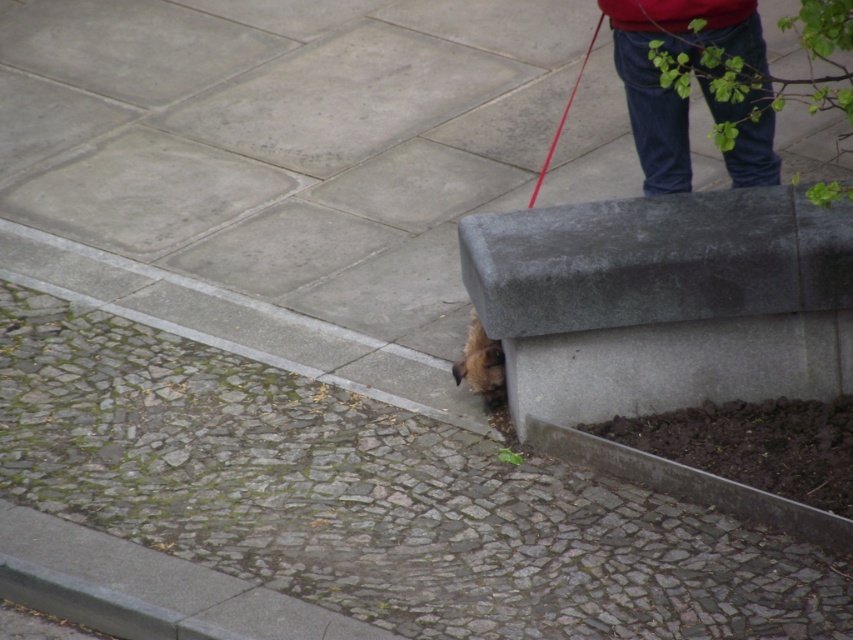
Question: Among these points, which one is nearest to the camera?

Choices:
 (A) (596, 33)
 (B) (741, 172)
 (C) (502, 358)

Answer: (C)

Question: Is denim pants at upper right below red rubber leash at upper right?

Choices:
 (A) no
 (B) yes

Answer: (B)

Question: Among these objects, which one is farthest from the camera?

Choices:
 (A) denim pants at upper right
 (B) red rubber leash at upper right
 (C) brown furry dog at lower center

Answer: (B)

Question: Which point is closer to the camera?

Choices:
 (A) (477, 328)
 (B) (654, 192)

Answer: (A)

Question: Can you confirm if denim pants at upper right is positioned above red rubber leash at upper right?

Choices:
 (A) no
 (B) yes

Answer: (A)

Question: Is denim pants at upper right thinner than red rubber leash at upper right?

Choices:
 (A) no
 (B) yes

Answer: (A)